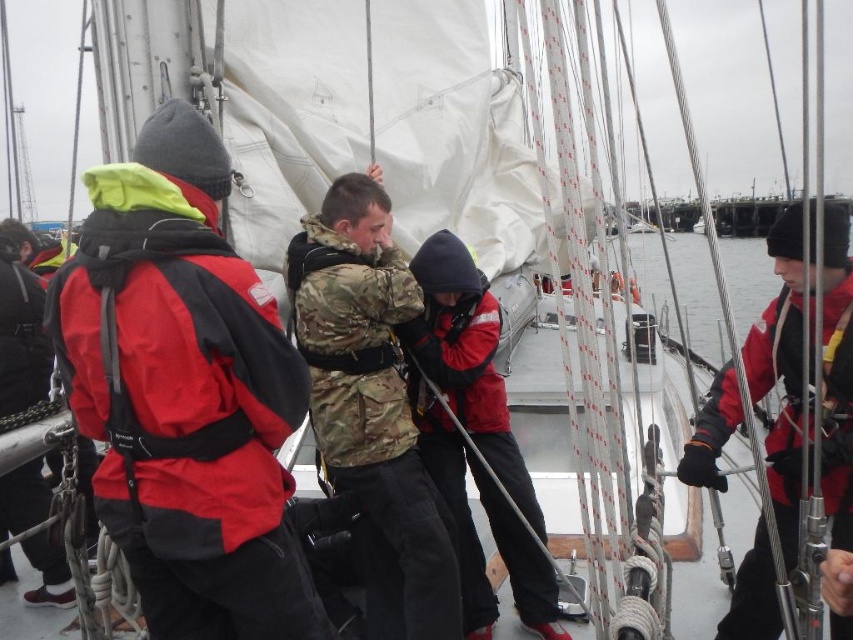
Is red matte jacket at right thinner than matte black jacket at center?

No, red matte jacket at right is not thinner than matte black jacket at center.

Is red matte jacket at right bigger than matte black jacket at center?

Yes.

Is point (849, 458) closer to camera compared to point (527, 552)?

Yes, point (849, 458) is closer to viewer.

I want to click on red matte jacket at right, so click(781, 374).

Is red matte jacket at left below red matte life jacket at center?

Yes.

Between red matte jacket at left and red matte life jacket at center, which one has less height?

red matte life jacket at center

Describe the element at coordinates (184, 394) in the screenshot. I see `red matte jacket at left` at that location.

The image size is (853, 640). I want to click on red matte jacket at left, so click(x=184, y=394).

Who is shorter, camo fabric jacket at center or red matte jacket at right?

Standing shorter between the two is camo fabric jacket at center.

Between camo fabric jacket at center and red matte jacket at right, which one is positioned lower?

camo fabric jacket at center is below.

Who is more distant from viewer, [357,376] or [753,397]?

Positioned behind is point [753,397].

This screenshot has height=640, width=853. What are the coordinates of `camo fabric jacket at center` in the screenshot? It's located at (370, 406).